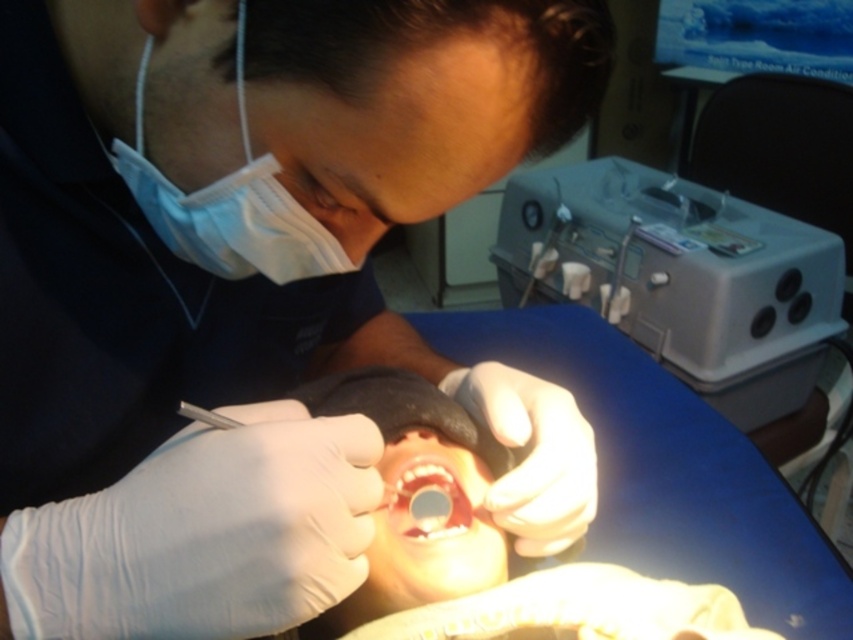
You are a dental assistant observing the dental procedure. You need to place a small tray of tools between the gray plastic machine at upper right and the smooth pinkish flesh at center. Based on their widths, will the tray fit between them?

The gray plastic machine at upper right is wider than the smooth pinkish flesh at center. Therefore, the tray can fit between them as there is sufficient space between their widths.

You are a dental assistant and need to place two markers on the dental tools at the coordinates point (x=102, y=260) and point (x=440, y=506). Which point is closer to you?

Point (x=102, y=260) is closer to the viewer than point (x=440, y=506).